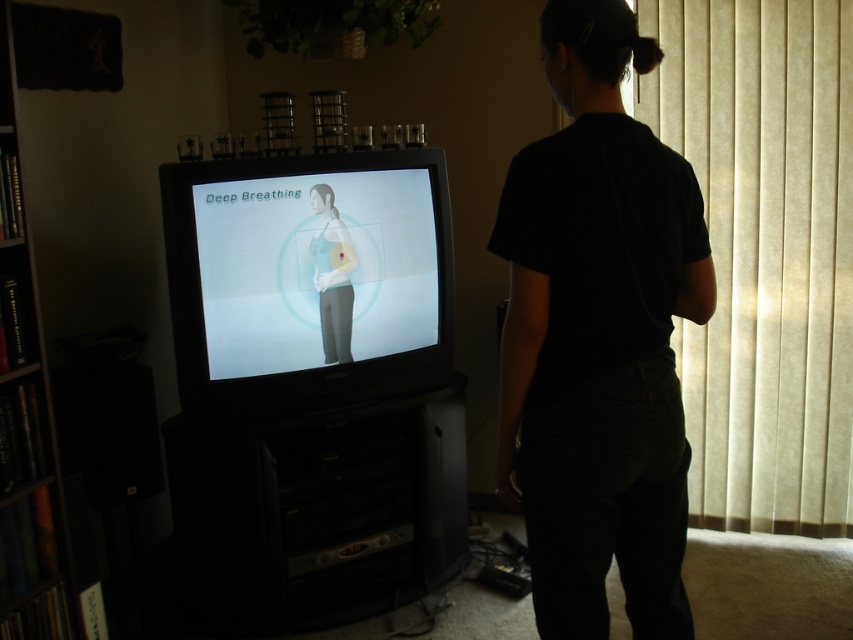
Which is behind, point (236, 481) or point (59, 618)?

The point (236, 481) is more distant.

Can you confirm if black plastic entertainment center at lower center is taller than wooden bookshelf at left?

No, black plastic entertainment center at lower center is not taller than wooden bookshelf at left.

Image resolution: width=853 pixels, height=640 pixels. Find the location of `black plastic entertainment center at lower center`. black plastic entertainment center at lower center is located at coordinates (317, 513).

Who is higher up, black cotton shirt at center or matte gray tank top at center?

matte gray tank top at center is higher up.

Is black cotton shirt at center positioned at the back of matte gray tank top at center?

That is False.

Where is `black cotton shirt at center`? The width and height of the screenshot is (853, 640). black cotton shirt at center is located at coordinates pyautogui.click(x=598, y=337).

Who is higher up, black cotton shirt at center or wooden bookshelf at left?

black cotton shirt at center

Between black cotton shirt at center and wooden bookshelf at left, which one has more height?

wooden bookshelf at left is taller.

Does point (669, 209) come behind point (7, 244)?

No, it is in front of (7, 244).

The image size is (853, 640). Identify the location of black cotton shirt at center. (598, 337).